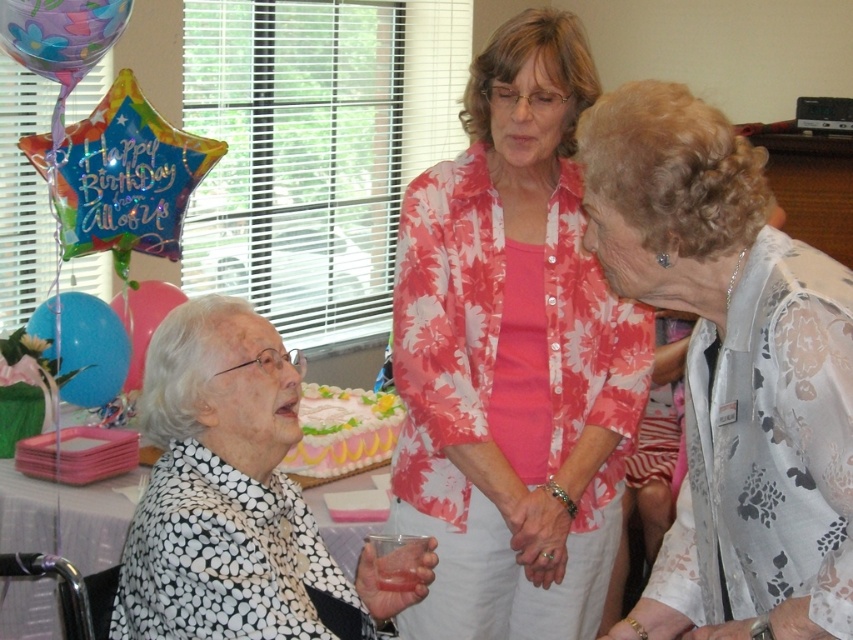
Does pink floral blouse at center have a smaller size compared to floral-patterned balloon at upper left?

Incorrect, pink floral blouse at center is not smaller in size than floral-patterned balloon at upper left.

Between pink floral blouse at center and floral-patterned balloon at upper left, which one has more height?

Standing taller between the two is pink floral blouse at center.

Does point (525, 106) lie in front of point (38, 58)?

No.

You are a GUI agent. You are given a task and a screenshot of the screen. Output one action in this format:
    pyautogui.click(x=<x>, y=<y>)
    Task: Click on the pink floral blouse at center
    The height and width of the screenshot is (640, 853).
    Given the screenshot: What is the action you would take?
    pyautogui.click(x=514, y=356)

Is white floral blouse at center closer to camera compared to floral-patterned balloon at upper left?

Yes, it is in front of floral-patterned balloon at upper left.

From the picture: Can you confirm if white floral blouse at center is thinner than floral-patterned balloon at upper left?

No, white floral blouse at center is not thinner than floral-patterned balloon at upper left.

Locate an element on the screen. The image size is (853, 640). white floral blouse at center is located at coordinates (730, 371).

Is point (341, 413) behind point (51, 317)?

No.

Is point (358, 388) closer to camera compared to point (90, 372)?

No, (358, 388) is behind (90, 372).

Is point (363, 429) positioned before point (112, 317)?

Yes, point (363, 429) is in front of point (112, 317).

Where is `white frosted cake at center`? The width and height of the screenshot is (853, 640). white frosted cake at center is located at coordinates (343, 429).